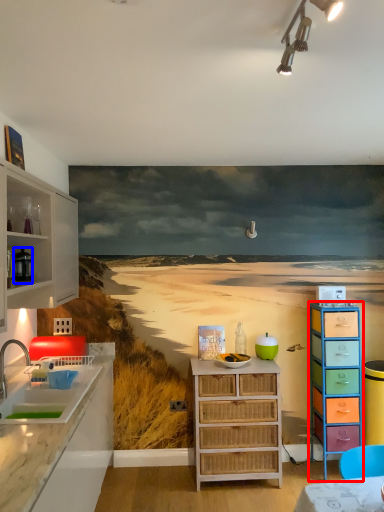
Question: Among these objects, which one is farthest to the camera, chest of drawers (highlighted by a red box) or appliance (highlighted by a blue box)?

Choices:
 (A) chest of drawers
 (B) appliance

Answer: (A)